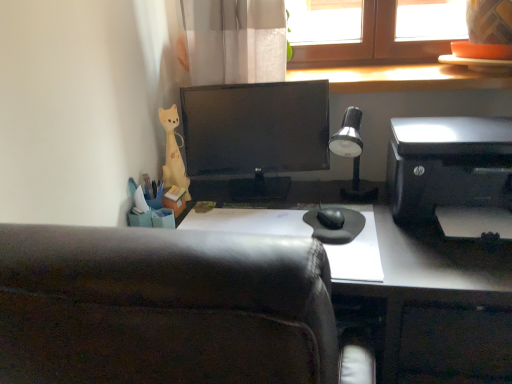
This screenshot has height=384, width=512. I want to click on leather at center, so click(164, 308).

Image resolution: width=512 pixels, height=384 pixels. Find the location of `leather at center`. leather at center is located at coordinates (164, 308).

From the picture: Which is closer, (182, 326) or (354, 127)?

The point (182, 326) is closer to the camera.

Can you confirm if leather at center is thinner than silver metallic desk lamp at upper right?

No.

Is leather at center turned away from silver metallic desk lamp at upper right?

No, leather at center is not facing away from silver metallic desk lamp at upper right.

Identify the location of chair located in front of the silver metallic desk lamp at upper right. tap(164, 308).

Which object is thinner, wooden at upper right or leather at center?

Thinner between the two is wooden at upper right.

Considering the relative positions of wooden at upper right and leather at center in the image provided, is wooden at upper right to the right of leather at center from the viewer's perspective?

Indeed, wooden at upper right is positioned on the right side of leather at center.

Is leather at center oriented towards wooden at upper right?

Yes, leather at center is facing wooden at upper right.

Which object is more forward, leather at center or wooden at upper right?

leather at center is closer to the camera.

From the image's perspective, is leather at center located above or below wooden at upper right?

leather at center is below wooden at upper right.

From a real-world perspective, does leather at center sit lower than wooden at upper right?

Yes, from a real-world perspective, leather at center is beneath wooden at upper right.

Is yellow matte figurine at upper left positioned in front of black plastic printer at right?

No, yellow matte figurine at upper left is further to the viewer.

Considering the sizes of yellow matte figurine at upper left and black plastic printer at right in the image, is yellow matte figurine at upper left taller or shorter than black plastic printer at right?

Clearly, yellow matte figurine at upper left is taller compared to black plastic printer at right.

From the image's perspective, is yellow matte figurine at upper left located above or below black plastic printer at right?

yellow matte figurine at upper left is above black plastic printer at right.

Are yellow matte figurine at upper left and black plastic printer at right located far from each other?

No, there isn't a large distance between yellow matte figurine at upper left and black plastic printer at right.

From the image's perspective, is silver metallic desk lamp at upper right over yellow matte figurine at upper left?

No, from the image's perspective, silver metallic desk lamp at upper right is not on top of yellow matte figurine at upper left.

Is silver metallic desk lamp at upper right further to camera compared to yellow matte figurine at upper left?

No, silver metallic desk lamp at upper right is closer to the camera.

Is silver metallic desk lamp at upper right facing towards yellow matte figurine at upper left?

No, silver metallic desk lamp at upper right is not aimed at yellow matte figurine at upper left.

Is silver metallic desk lamp at upper right with yellow matte figurine at upper left?

silver metallic desk lamp at upper right and yellow matte figurine at upper left are not in contact.

Find the location of a particular element. This screenshot has width=512, height=384. printer that appears in front of the wooden at upper right is located at coordinates (452, 174).

Can wooden at upper right be found inside black plastic printer at right?

No, wooden at upper right is not surrounded by black plastic printer at right.

Measure the distance from black plastic printer at right to wooden at upper right.

black plastic printer at right and wooden at upper right are 12.53 inches apart.

Is black plastic printer at right in contact with wooden at upper right?

There is a gap between black plastic printer at right and wooden at upper right.

Considering their positions, is leather at center located in front of or behind black plastic printer at right?

In the image, leather at center appears in front of black plastic printer at right.

Would you say leather at center contains black plastic printer at right?

That's incorrect, black plastic printer at right is not inside leather at center.

Is point (45, 382) in front of point (400, 140)?

Yes.

Where is `chair in front of the silver metallic desk lamp at upper right`? chair in front of the silver metallic desk lamp at upper right is located at coordinates (164, 308).

This screenshot has width=512, height=384. Find the location of `window sill positioned vertically above the leather at center (from a real-world perspective)`. window sill positioned vertically above the leather at center (from a real-world perspective) is located at coordinates (402, 78).

Based on their spatial positions, is silver metallic desk lamp at upper right or black plastic printer at right further from yellow matte figurine at upper left?

black plastic printer at right lies further to yellow matte figurine at upper left than the other object.

Which object lies nearer to the anchor point yellow matte figurine at upper left, black plastic printer at right or leather at center?

black plastic printer at right.

Considering their positions, is leather at center positioned closer to wooden at upper right than silver metallic desk lamp at upper right?

silver metallic desk lamp at upper right lies closer to wooden at upper right than the other object.

Which object lies further to the anchor point wooden at upper right, black plastic printer at right or leather at center?

Among the two, leather at center is located further to wooden at upper right.

From the image, which object appears to be nearer to black plastic printer at right, leather at center or wooden at upper right?

wooden at upper right is closer to black plastic printer at right.

When comparing their distances from yellow matte figurine at upper left, does silver metallic desk lamp at upper right or wooden at upper right seem closer?

Based on the image, silver metallic desk lamp at upper right appears to be nearer to yellow matte figurine at upper left.

Based on their spatial positions, is yellow matte figurine at upper left or black plastic printer at right closer to wooden at upper right?

black plastic printer at right.

Based on their spatial positions, is wooden at upper right or black plastic printer at right further from yellow matte figurine at upper left?

The object further to yellow matte figurine at upper left is black plastic printer at right.

Locate an element on the screen. Image resolution: width=512 pixels, height=384 pixels. printer between leather at center and silver metallic desk lamp at upper right from front to back is located at coordinates (452, 174).

The width and height of the screenshot is (512, 384). I want to click on printer located between leather at center and wooden at upper right in the depth direction, so click(x=452, y=174).

Where is `window sill between yellow matte figurine at upper left and black plastic printer at right`? window sill between yellow matte figurine at upper left and black plastic printer at right is located at coordinates (402, 78).

The height and width of the screenshot is (384, 512). Identify the location of lamp between yellow matte figurine at upper left and black plastic printer at right. (351, 153).